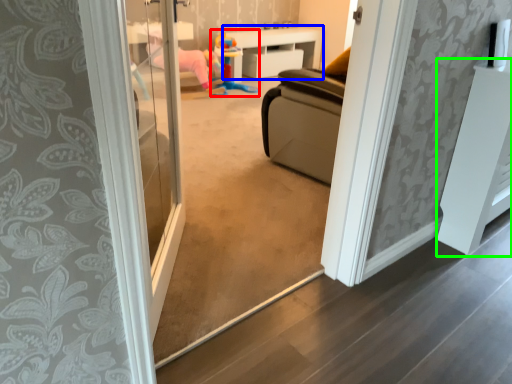
Question: Considering the real-world distances, which object is closest to toy (highlighted by a red box)? furniture (highlighted by a blue box) or furniture (highlighted by a green box).

Choices:
 (A) furniture
 (B) furniture

Answer: (A)